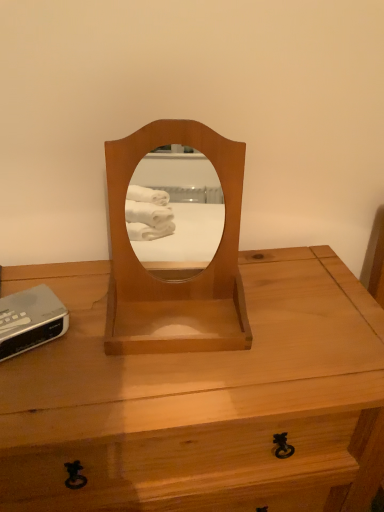
The height and width of the screenshot is (512, 384). In order to click on free space to the left of light brown wood mirror at center in this screenshot , I will do `click(71, 320)`.